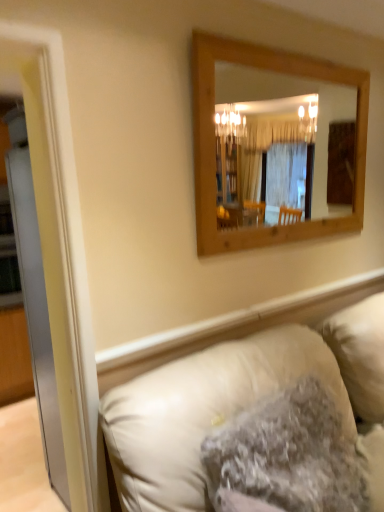
The height and width of the screenshot is (512, 384). What do you see at coordinates (286, 456) in the screenshot?
I see `fuzzy beige pillow at lower center` at bounding box center [286, 456].

Identify the location of wooden mirror at upper center. Image resolution: width=384 pixels, height=512 pixels. 292,96.

Measure the distance between point (263, 81) and camera.

Point (263, 81) and camera are 13.04 feet apart from each other.

Locate an element on the screen. leather couch at lower right is located at coordinates (233, 400).

Find the location of a particular element. The height and width of the screenshot is (512, 384). fuzzy beige pillow at lower center is located at coordinates (286, 456).

Is white glossy door at left to the right of fuzzy beige pillow at lower center from the viewer's perspective?

Incorrect, white glossy door at left is not on the right side of fuzzy beige pillow at lower center.

Is point (35, 230) in front of point (261, 437)?

No, it is not.

Is white glossy door at left behind fuzzy beige pillow at lower center?

No, the depth of white glossy door at left is less than that of fuzzy beige pillow at lower center.

Does fuzzy beige pillow at lower center appear on the left side of white glossy door at left?

No.

Can you confirm if fuzzy beige pillow at lower center is wider than white glossy door at left?

Correct, the width of fuzzy beige pillow at lower center exceeds that of white glossy door at left.

The height and width of the screenshot is (512, 384). I want to click on pillow below the white glossy door at left (from a real-world perspective), so click(286, 456).

In the scene shown: Visually, is wooden mirror at upper center positioned to the left or to the right of leather couch at lower right?

wooden mirror at upper center is to the right of leather couch at lower right.

From the image's perspective, which one is positioned higher, wooden mirror at upper center or leather couch at lower right?

From the image's view, wooden mirror at upper center is above.

Is point (276, 89) less distant than point (191, 440)?

No, (276, 89) is further to viewer.

Considering the sizes of wooden mirror at upper center and leather couch at lower right in the image, is wooden mirror at upper center wider or thinner than leather couch at lower right?

In the image, wooden mirror at upper center appears to be more narrow than leather couch at lower right.

Do you think fuzzy beige pillow at lower center is within leather couch at lower right, or outside of it?

fuzzy beige pillow at lower center exists entirely within leather couch at lower right.

Are fuzzy beige pillow at lower center and leather couch at lower right making contact?

No, fuzzy beige pillow at lower center is not next to leather couch at lower right.

Does fuzzy beige pillow at lower center have a lesser width compared to leather couch at lower right?

Indeed, fuzzy beige pillow at lower center has a lesser width compared to leather couch at lower right.

Is fuzzy beige pillow at lower center facing towards leather couch at lower right?

Yes.

Would you say leather couch at lower right is to the left or to the right of fuzzy beige pillow at lower center in the picture?

Based on their positions, leather couch at lower right is located to the right of fuzzy beige pillow at lower center.

From the image's perspective, is leather couch at lower right located above or below fuzzy beige pillow at lower center?

From the image's perspective, leather couch at lower right appears below fuzzy beige pillow at lower center.

Is leather couch at lower right positioned with its back to fuzzy beige pillow at lower center?

Correct, leather couch at lower right is looking away from fuzzy beige pillow at lower center.

From a real-world perspective, is leather couch at lower right physically below fuzzy beige pillow at lower center?

Correct, in the physical world, leather couch at lower right is lower than fuzzy beige pillow at lower center.

Is wooden mirror at upper center bigger or smaller than fuzzy beige pillow at lower center?

In the image, wooden mirror at upper center appears to be smaller than fuzzy beige pillow at lower center.

Is wooden mirror at upper center looking in the opposite direction of fuzzy beige pillow at lower center?

That's not correct — wooden mirror at upper center is not looking away from fuzzy beige pillow at lower center.

Is wooden mirror at upper center behind fuzzy beige pillow at lower center?

Yes, the depth of wooden mirror at upper center is greater than that of fuzzy beige pillow at lower center.

Is wooden mirror at upper center positioned beyond the bounds of fuzzy beige pillow at lower center?

Yes, wooden mirror at upper center is not within fuzzy beige pillow at lower center.

How different are the orientations of wooden mirror at upper center and white glossy door at left in degrees?

They differ by 0.11 degrees in their facing directions.

Is wooden mirror at upper center far away from white glossy door at left?

Yes.

Considering the positions of objects wooden mirror at upper center and white glossy door at left in the image provided, who is more to the left, wooden mirror at upper center or white glossy door at left?

white glossy door at left.

Is wooden mirror at upper center outside of white glossy door at left?

Absolutely, wooden mirror at upper center is external to white glossy door at left.

The height and width of the screenshot is (512, 384). Find the location of `glass door above the fuzzy beige pillow at lower center (from a real-world perspective)`. glass door above the fuzzy beige pillow at lower center (from a real-world perspective) is located at coordinates (36, 313).

The width and height of the screenshot is (384, 512). What are the coordinates of `pillow below the white glossy door at left (from the image's perspective)` in the screenshot? It's located at (286, 456).

From the image, which object appears to be nearer to wooden mirror at upper center, fuzzy beige pillow at lower center or leather couch at lower right?

leather couch at lower right is positioned closer to the anchor wooden mirror at upper center.

Considering their positions, is leather couch at lower right positioned closer to white glossy door at left than fuzzy beige pillow at lower center?

leather couch at lower right lies closer to white glossy door at left than the other object.

Looking at the image, which one is located closer to leather couch at lower right, fuzzy beige pillow at lower center or white glossy door at left?

The object closer to leather couch at lower right is fuzzy beige pillow at lower center.

When comparing their distances from leather couch at lower right, does white glossy door at left or wooden mirror at upper center seem closer?

white glossy door at left is positioned closer to the anchor leather couch at lower right.

Estimate the real-world distances between objects in this image. Which object is closer to fuzzy beige pillow at lower center, leather couch at lower right or wooden mirror at upper center?

Among the two, leather couch at lower right is located nearer to fuzzy beige pillow at lower center.

From the image, which object appears to be farther from leather couch at lower right, wooden mirror at upper center or white glossy door at left?

wooden mirror at upper center.

From the image, which object appears to be farther from wooden mirror at upper center, leather couch at lower right or fuzzy beige pillow at lower center?

The object further to wooden mirror at upper center is fuzzy beige pillow at lower center.

Considering their positions, is wooden mirror at upper center positioned further to white glossy door at left than leather couch at lower right?

Among the two, wooden mirror at upper center is located further to white glossy door at left.

The width and height of the screenshot is (384, 512). In order to click on glass door between wooden mirror at upper center and leather couch at lower right in the up-down direction in this screenshot , I will do `click(36, 313)`.

The image size is (384, 512). Find the location of `pillow between white glossy door at left and leather couch at lower right`. pillow between white glossy door at left and leather couch at lower right is located at coordinates (286, 456).

I want to click on pillow between wooden mirror at upper center and leather couch at lower right vertically, so click(x=286, y=456).

The height and width of the screenshot is (512, 384). I want to click on glass door between wooden mirror at upper center and fuzzy beige pillow at lower center in the up-down direction, so click(36, 313).